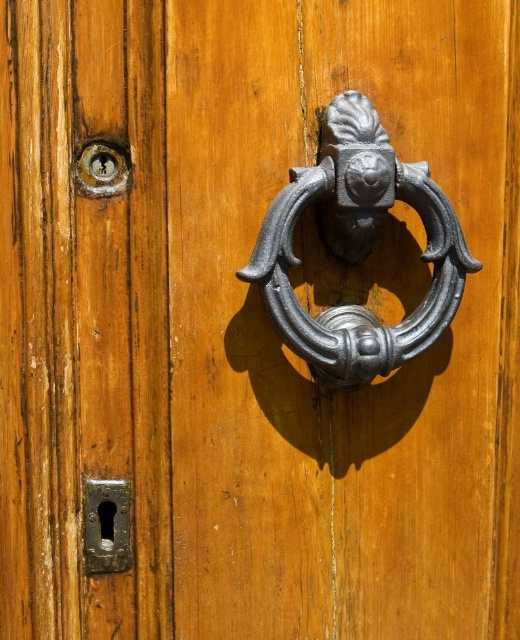
Is polished silver knocker at center above dark gray metal keyhole at lower left?

Indeed, polished silver knocker at center is positioned over dark gray metal keyhole at lower left.

Does polished silver knocker at center have a smaller size compared to dark gray metal keyhole at lower left?

No, polished silver knocker at center is not smaller than dark gray metal keyhole at lower left.

Is point (331, 134) more distant than point (85, 490)?

No, it is in front of (85, 490).

Find the location of `polished silver knocker at center`. polished silver knocker at center is located at coordinates (357, 248).